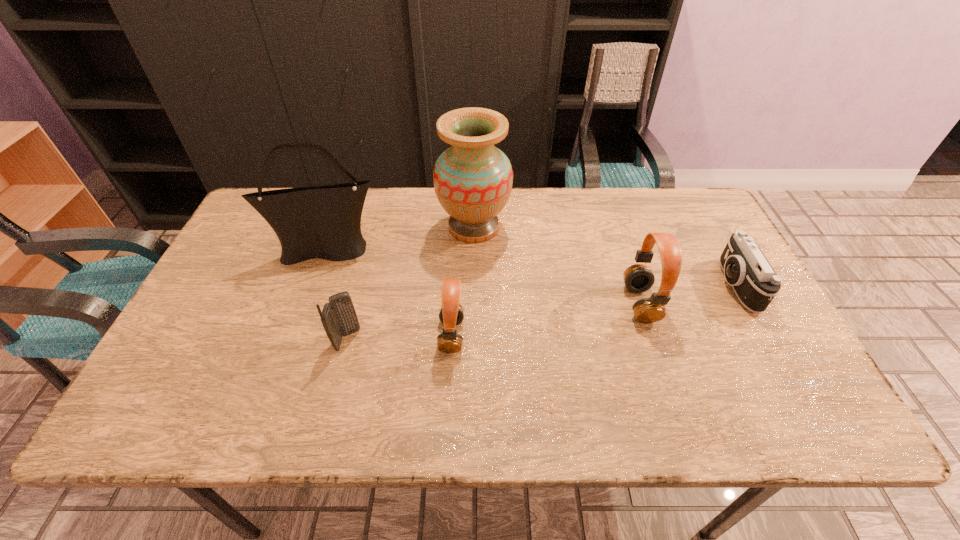
Identify the location of vacant area that lies between the shortest object and the right headset. (687, 294).

Locate an element on the screen. Image resolution: width=960 pixels, height=540 pixels. empty space between the rightmost object and the left headset is located at coordinates (593, 310).

Locate an element on the screen. The height and width of the screenshot is (540, 960). empty space that is in between the camera and the cellular telephone is located at coordinates (541, 312).

Where is `vacant area that lies between the fourth shortest object and the cellular telephone`? This screenshot has width=960, height=540. vacant area that lies between the fourth shortest object and the cellular telephone is located at coordinates (494, 321).

Locate an element on the screen. The image size is (960, 540). vacant area that lies between the shoulder bag and the vase is located at coordinates (400, 239).

The image size is (960, 540). In order to click on unoccupied position between the shoulder bag and the right headset in this screenshot , I will do `click(484, 277)`.

The image size is (960, 540). Find the location of `free space that is in between the vase and the shoulder bag`. free space that is in between the vase and the shoulder bag is located at coordinates (400, 239).

Identify the location of vacant space that's between the vase and the fifth object from left to right. (557, 265).

Where is `free spot between the taller headset and the vase`? This screenshot has height=540, width=960. free spot between the taller headset and the vase is located at coordinates (557, 265).

Point out which object is positioned as the third nearest to the fourth shortest object. Please provide its 2D coordinates. Your answer should be formatted as a tuple, i.e. [(x, y)], where the tuple contains the x and y coordinates of a point satisfying the conditions above.

[(451, 314)]